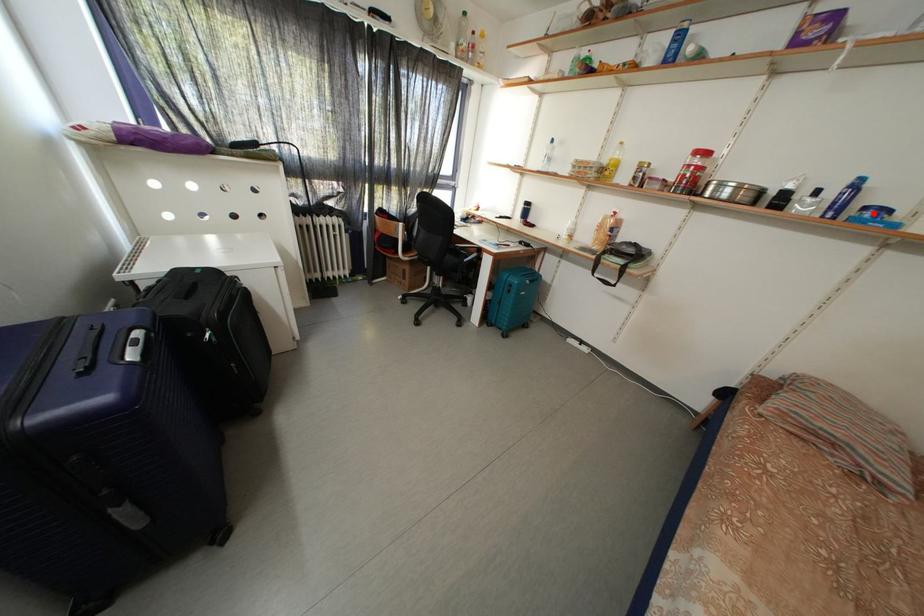
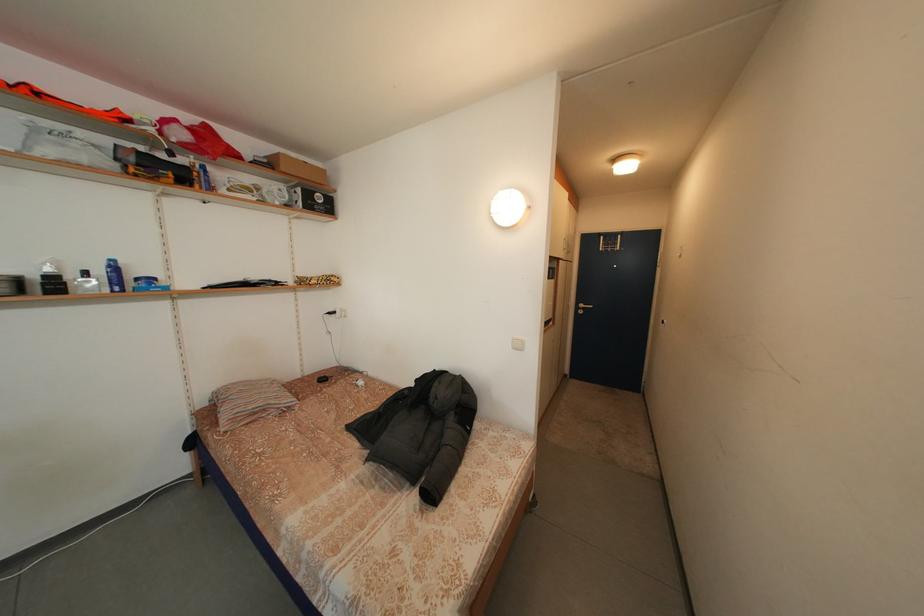
In the second image, find the point that corresponds to the highlighted location in the first image.

(146, 285)